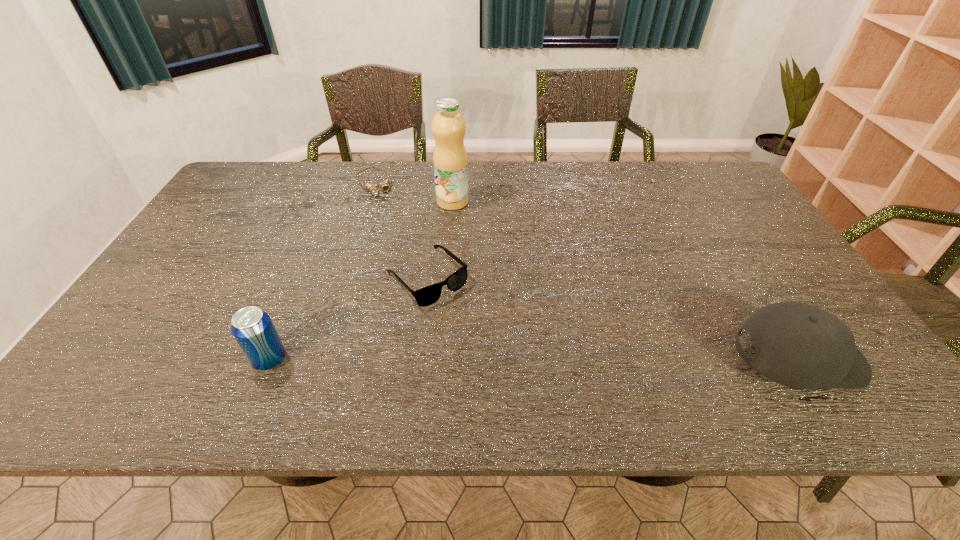
Identify the location of object that is the closest to the tallest object. (384, 185).

Locate an element on the screen. This screenshot has height=540, width=960. free region that satisfies the following two spatial constraints: 1. on the front side of the baseball cap; 2. with a logo on the front of the fruit juice is located at coordinates (440, 361).

Locate an element on the screen. vacant space that satisfies the following two spatial constraints: 1. on the front side of the baseball cap; 2. with a logo on the front of the tallest object is located at coordinates (440, 361).

Find the location of a particular element. vacant point that satisfies the following two spatial constraints: 1. on the back side of the third farthest object; 2. on the right side of the leftmost object is located at coordinates (303, 278).

Image resolution: width=960 pixels, height=540 pixels. What are the coordinates of `free point that satisfies the following two spatial constraints: 1. on the front side of the beer can; 2. with a logo on the front of the baseball cap` in the screenshot? It's located at (269, 361).